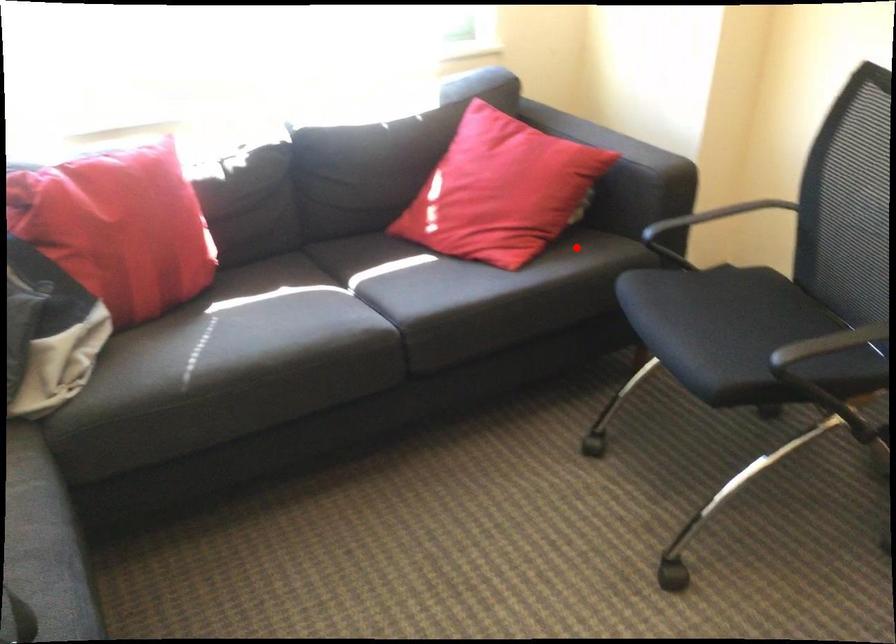
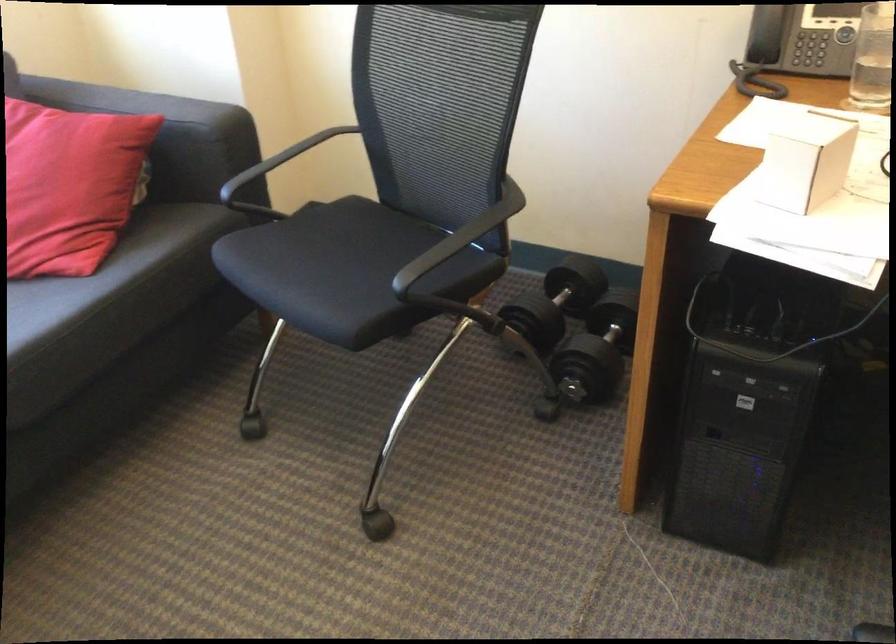
The point at the highlighted location is marked in the first image. Where is the corresponding point in the second image?

(156, 230)